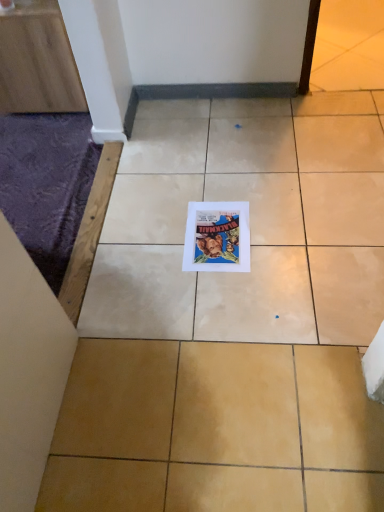
What are the coordinates of `free space underneath matte paper comic book at center (from a real-world perspective)` in the screenshot? It's located at (219, 237).